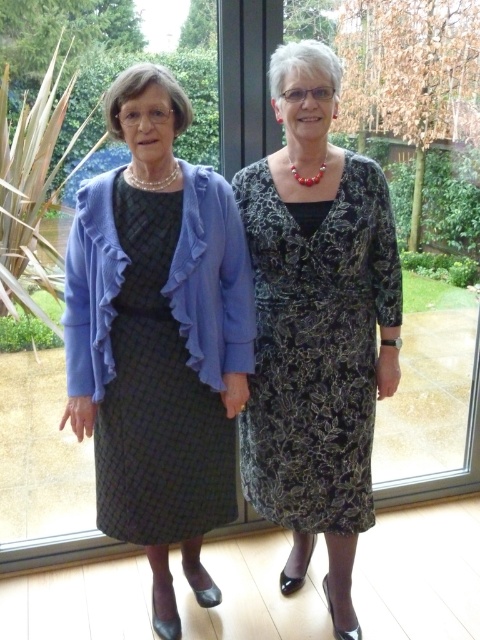
Question: Is black textured dress at center to the right of black textured dress at left from the viewer's perspective?

Choices:
 (A) no
 (B) yes

Answer: (B)

Question: Considering the real-world distances, which object is farthest from the black textured dress at center?

Choices:
 (A) matte blue cardigan at left
 (B) black textured dress at left

Answer: (B)

Question: Which of the following is the closest to the observer?

Choices:
 (A) black textured dress at left
 (B) matte blue cardigan at left

Answer: (B)

Question: Does matte blue cardigan at left have a lesser width compared to black textured dress at left?

Choices:
 (A) yes
 (B) no

Answer: (B)

Question: Which point is closer to the camera?

Choices:
 (A) black textured dress at left
 (B) matte blue cardigan at left
 (C) black textured dress at center

Answer: (B)

Question: Can you confirm if matte blue cardigan at left is thinner than black textured dress at center?

Choices:
 (A) yes
 (B) no

Answer: (B)